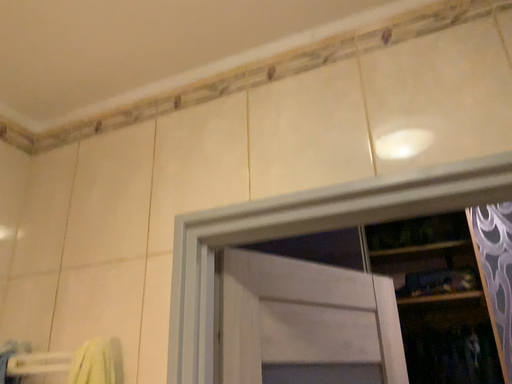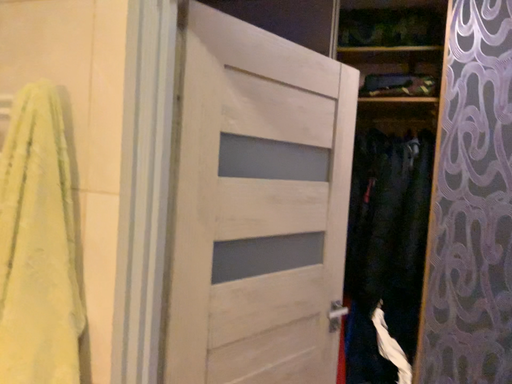
Question: How did the camera likely rotate when shooting the video?

Choices:
 (A) rotated downward
 (B) rotated upward

Answer: (A)